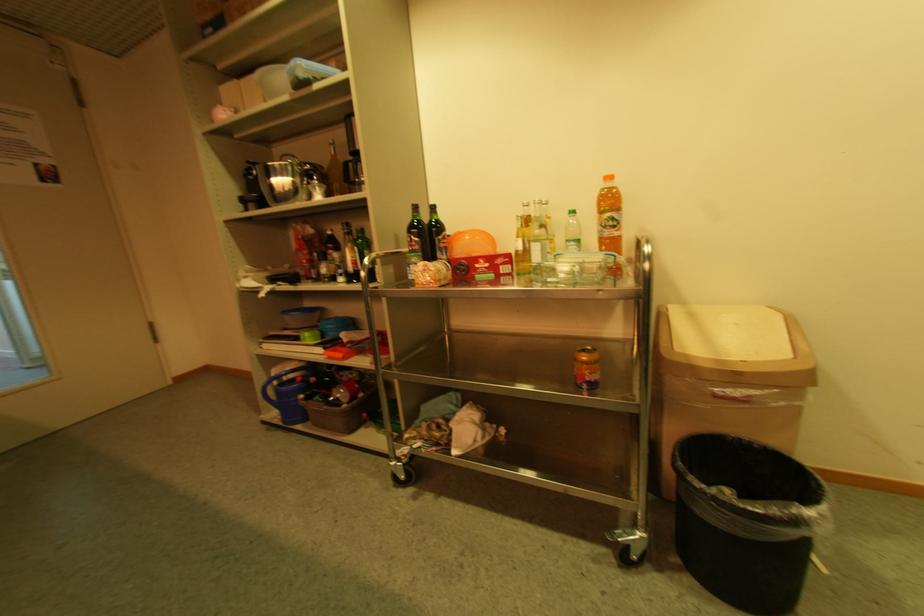
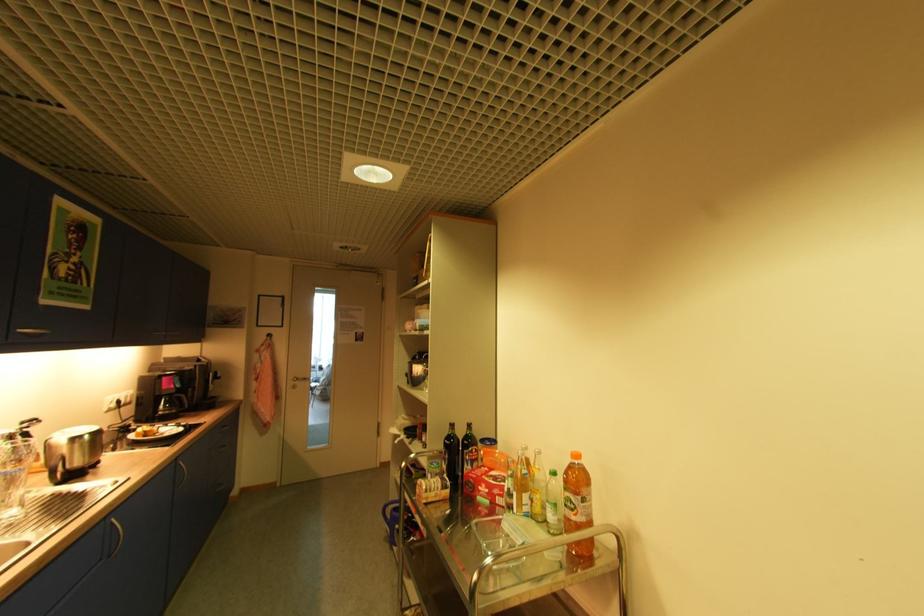
Where in the second image is the point corresponding to pixel 497 276 from the first image?

(492, 503)